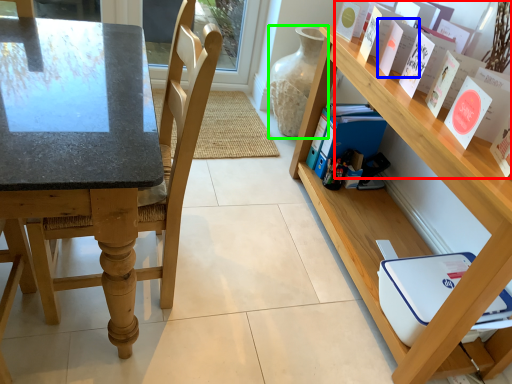
Question: Considering the real-world distances, which object is closest to book (highlighted by a red box)? paperback book (highlighted by a blue box) or glass vase (highlighted by a green box).

Choices:
 (A) paperback book
 (B) glass vase

Answer: (A)